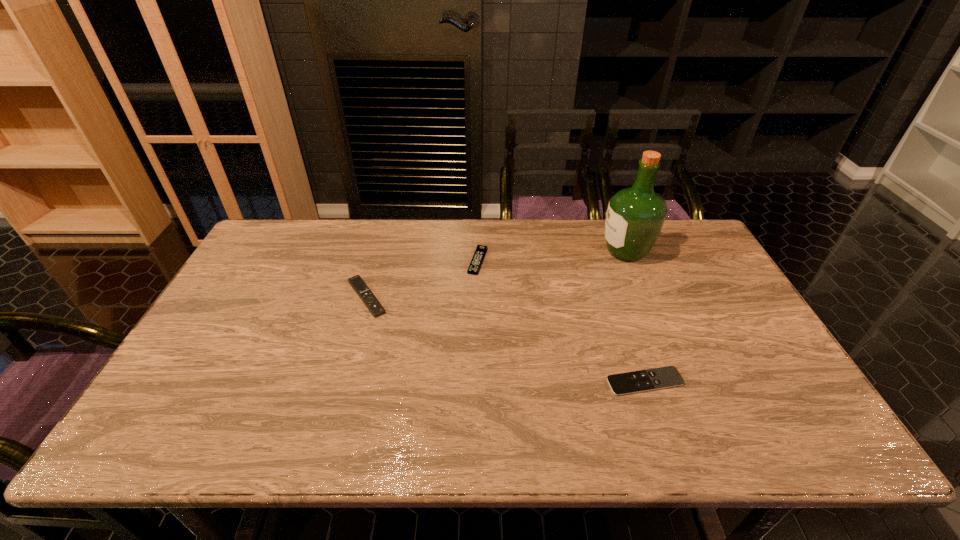
This screenshot has width=960, height=540. I want to click on vacant area located on the right of the third shortest object, so click(494, 298).

Identify the location of free region located on the back of the third object from right to left. This screenshot has height=540, width=960. (478, 219).

You are a GUI agent. You are given a task and a screenshot of the screen. Output one action in this format:
    pyautogui.click(x=<x>, y=<y>)
    Task: Click on the free space located on the left of the shortest object
    The width and height of the screenshot is (960, 540).
    Given the screenshot: What is the action you would take?
    pyautogui.click(x=546, y=382)

Locate an element on the screen. The image size is (960, 540). liquor that is at the far edge is located at coordinates (635, 216).

The height and width of the screenshot is (540, 960). Identify the location of remote control positioned at the far edge. (475, 264).

Locate an element on the screen. vacant area at the far edge is located at coordinates (499, 256).

Locate an element on the screen. Image resolution: width=960 pixels, height=540 pixels. free space at the left edge is located at coordinates (252, 286).

Identify the location of vacant region at the right edge. (668, 261).

At what (x,y) coordinates should I click in order to perform the action: click on vacant region at the far left corner. Please return your answer as a coordinate pair (x, y). Looking at the image, I should click on (289, 220).

Where is `free space at the far right corner of the desktop`? The image size is (960, 540). free space at the far right corner of the desktop is located at coordinates pos(712,260).